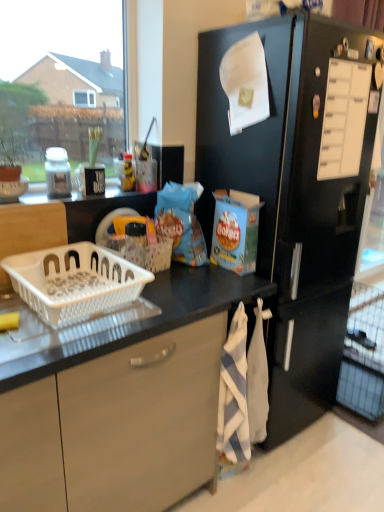
Question: From a real-world perspective, is white plastic basket at lower left, which is the second basket from back to front, below black matte refrigerator at right?

Choices:
 (A) yes
 (B) no

Answer: (B)

Question: Are white plastic basket at lower left, which is the second basket from back to front, and black matte refrigerator at right located far from each other?

Choices:
 (A) no
 (B) yes

Answer: (A)

Question: Is white plastic basket at lower left, which is the second basket from back to front, oriented away from black matte refrigerator at right?

Choices:
 (A) yes
 (B) no

Answer: (B)

Question: From the image's perspective, does white plastic basket at lower left, which is the second basket from back to front, appear lower than black matte refrigerator at right?

Choices:
 (A) no
 (B) yes

Answer: (B)

Question: Is white plastic basket at lower left, which is the second basket from back to front, in contact with black matte refrigerator at right?

Choices:
 (A) yes
 (B) no

Answer: (B)

Question: Considering the positions of white striped towel at lower center and white plastic basket at center, acting as the 2th basket starting from the front, in the image, is white striped towel at lower center taller or shorter than white plastic basket at center, acting as the 2th basket starting from the front,?

Choices:
 (A) tall
 (B) short

Answer: (A)

Question: From a real-world perspective, relative to white plastic basket at center, which is counted as the 1th basket, starting from the back, is white striped towel at lower center vertically above or below?

Choices:
 (A) above
 (B) below

Answer: (B)

Question: Is point (241, 448) closer or farther from the camera than point (160, 246)?

Choices:
 (A) farther
 (B) closer

Answer: (B)

Question: From the image's perspective, is white striped towel at lower center positioned above or below white plastic basket at center, which is counted as the 1th basket, starting from the back?

Choices:
 (A) below
 (B) above

Answer: (A)

Question: Is white matte jar at left in front of or behind white plastic drawer at upper right in the image?

Choices:
 (A) behind
 (B) front

Answer: (A)

Question: From their relative heights in the image, would you say white matte jar at left is taller or shorter than white plastic drawer at upper right?

Choices:
 (A) tall
 (B) short

Answer: (B)

Question: From a real-world perspective, is white matte jar at left physically located above or below white plastic drawer at upper right?

Choices:
 (A) above
 (B) below

Answer: (B)

Question: Based on their positions, is white matte jar at left located to the left or right of white plastic drawer at upper right?

Choices:
 (A) left
 (B) right

Answer: (A)

Question: From the image's perspective, is black matte refrigerator at right positioned above or below white striped towel at lower center?

Choices:
 (A) above
 (B) below

Answer: (A)

Question: Visually, is black matte refrigerator at right positioned to the left or to the right of white striped towel at lower center?

Choices:
 (A) right
 (B) left

Answer: (A)